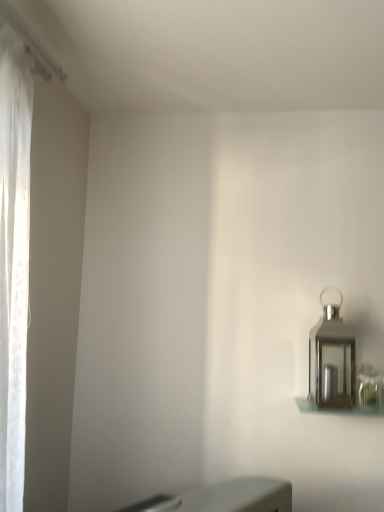
Question: Should I look upward or downward to see polished silver lantern at right?

Choices:
 (A) up
 (B) down

Answer: (B)